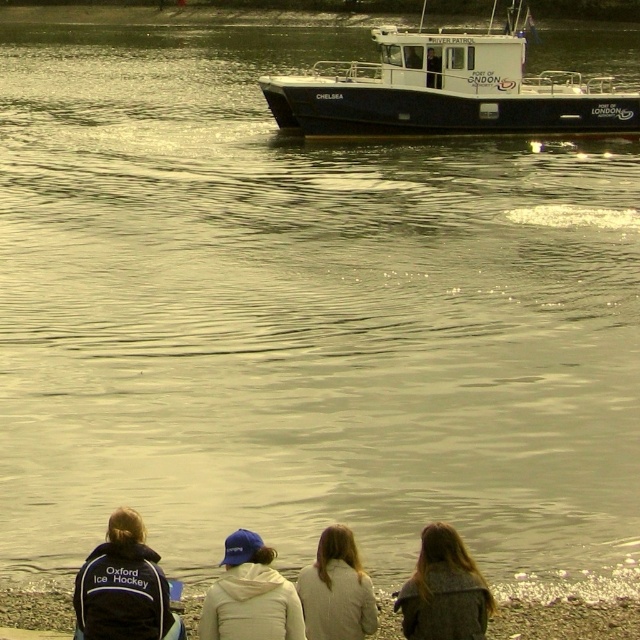
Question: Does white plastic boat at upper center have a lesser width compared to white fleece jacket at lower center?

Choices:
 (A) no
 (B) yes

Answer: (A)

Question: Considering the relative positions of white plastic boat at upper center and white fleece jacket at lower center in the image provided, where is white plastic boat at upper center located with respect to white fleece jacket at lower center?

Choices:
 (A) above
 (B) below

Answer: (A)

Question: Which is nearer to the smooth sand shoreline at lower center?

Choices:
 (A) white fleece jacket at lower center
 (B) white plastic boat at upper center
 (C) dark blue jacket at lower left

Answer: (A)

Question: Estimate the real-world distances between objects in this image. Which object is farther from the gray wool coat at lower right?

Choices:
 (A) white plastic boat at upper center
 (B) smooth sand shoreline at lower center
 (C) white fleece jacket at lower center
 (D) light gray sweater at center

Answer: (A)

Question: Which point appears farthest from the camera in this image?

Choices:
 (A) 444,61
 (B) 138,525
 (C) 193,605
 (D) 298,589

Answer: (A)

Question: Does smooth sand shoreline at lower center lie behind gray wool coat at lower right?

Choices:
 (A) yes
 (B) no

Answer: (A)